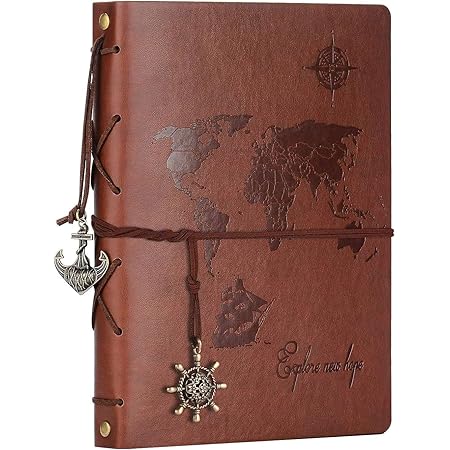
I want to click on book, so click(x=207, y=34).